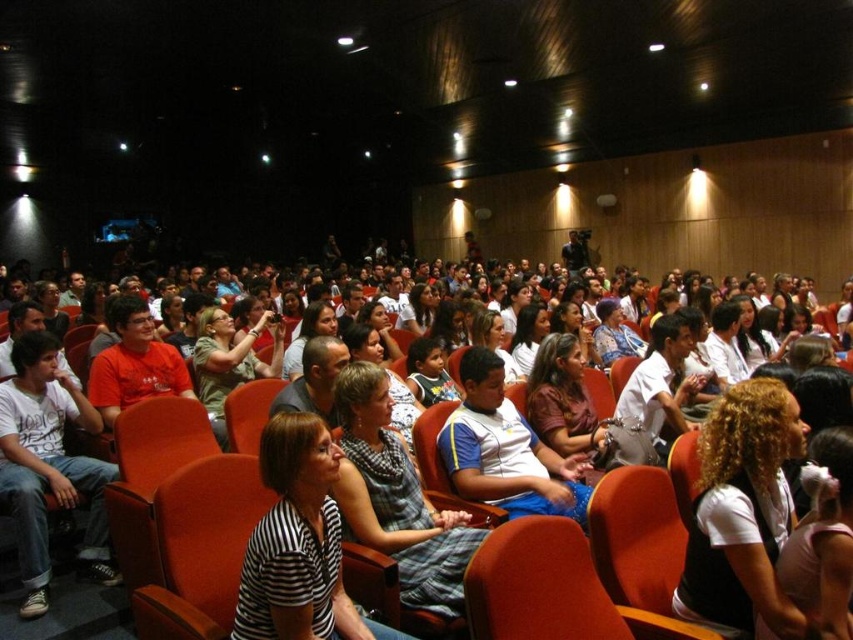
Who is higher up, white matte shirt at center or matte orange chair at center?

white matte shirt at center is higher up.

Does white matte shirt at center come in front of matte orange chair at center?

That is False.

Identify the location of white matte shirt at center. The height and width of the screenshot is (640, 853). (741, 509).

Is striped fabric dress at center above blue and white striped shirt at center?

Actually, striped fabric dress at center is below blue and white striped shirt at center.

Is striped fabric dress at center to the right of blue and white striped shirt at center from the viewer's perspective?

In fact, striped fabric dress at center is to the left of blue and white striped shirt at center.

Measure the distance between point (409, 588) and camera.

Point (409, 588) and camera are 2.37 meters apart from each other.

The image size is (853, 640). What are the coordinates of `striped fabric dress at center` in the screenshot? It's located at (396, 499).

Can you confirm if white cotton shirt at left is thinner than striped fabric dress at center?

In fact, white cotton shirt at left might be wider than striped fabric dress at center.

Who is more forward, [90,512] or [389,404]?

Point [389,404] is more forward.

This screenshot has width=853, height=640. Describe the element at coordinates (48, 465) in the screenshot. I see `white cotton shirt at left` at that location.

This screenshot has height=640, width=853. What are the coordinates of `white cotton shirt at left` in the screenshot? It's located at (48, 465).